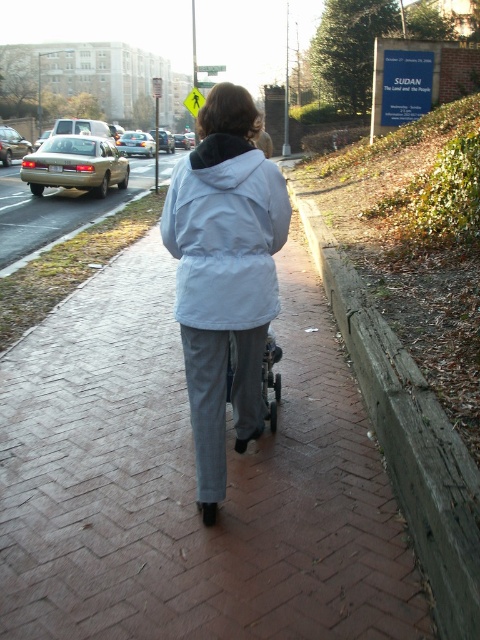
Measure the distance between light blue fabric at center and camera.

Result: They are 7.58 feet apart.

Can you confirm if light blue fabric at center is smaller than white matte jacket at center?

No, light blue fabric at center is not smaller than white matte jacket at center.

Locate an element on the screen. This screenshot has width=480, height=640. light blue fabric at center is located at coordinates (x=225, y=276).

Is brick pavement at center smaller than white matte jacket at center?

Actually, brick pavement at center might be larger than white matte jacket at center.

Which is in front, point (159, 314) or point (275, 234)?

Point (275, 234) is in front.

Is point (330, 531) closer to camera compared to point (243, 282)?

No, (330, 531) is further to viewer.

Identify the location of brick pavement at center. The height and width of the screenshot is (640, 480). (191, 483).

Between white matte jacket at center and metallic silver baby carriage at center, which one appears on the left side from the viewer's perspective?

From the viewer's perspective, white matte jacket at center appears more on the left side.

Is white matte jacket at center smaller than metallic silver baby carriage at center?

Actually, white matte jacket at center might be larger than metallic silver baby carriage at center.

Between point (240, 188) and point (276, 376), which one is positioned in front?

Positioned in front is point (240, 188).

Where is `white matte jacket at center`? The height and width of the screenshot is (640, 480). white matte jacket at center is located at coordinates (226, 234).